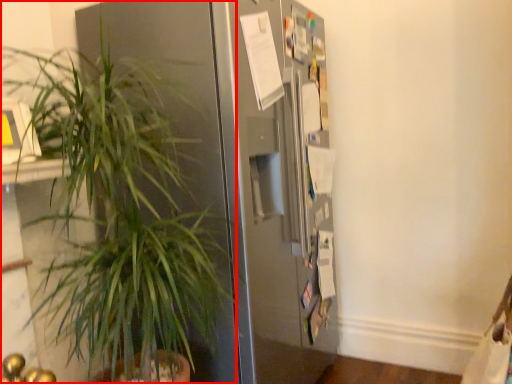
Question: From the image's perspective, what is the correct spatial relationship of houseplant (annotated by the red box) in relation to refrigerator?

Choices:
 (A) below
 (B) above

Answer: (A)